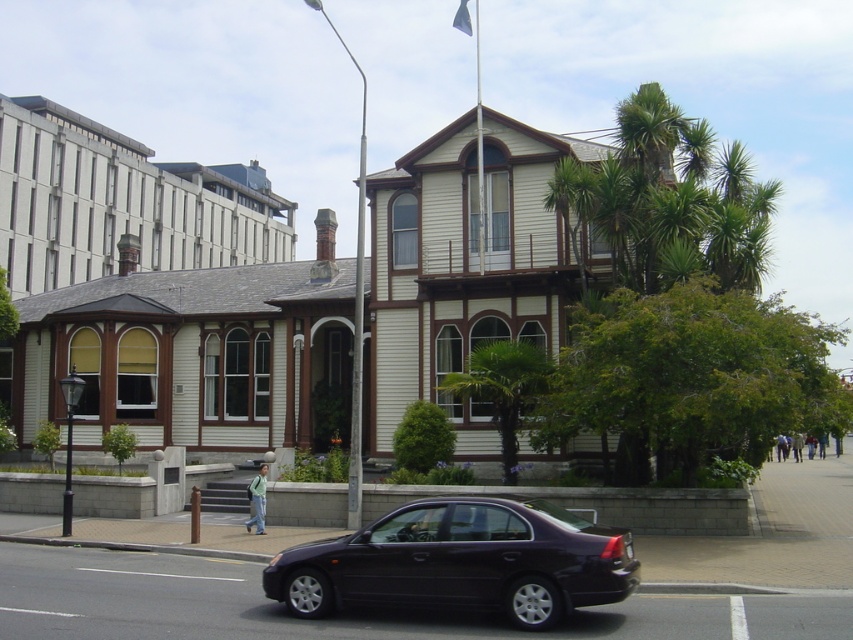
Question: Is satin black sedan at center above green leafy palm tree at center?

Choices:
 (A) no
 (B) yes

Answer: (A)

Question: Where is satin black sedan at center located in relation to green leafy palm tree at center in the image?

Choices:
 (A) left
 (B) right

Answer: (A)

Question: Is satin black sedan at center below green leafy palm tree at center?

Choices:
 (A) yes
 (B) no

Answer: (A)

Question: Which point is farther to the camera?

Choices:
 (A) (509, 449)
 (B) (463, 557)

Answer: (A)